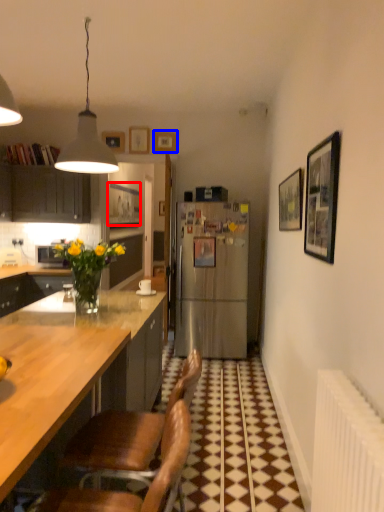
Question: Among these objects, which one is nearest to the camera, picture frame (highlighted by a red box) or picture frame (highlighted by a blue box)?

Choices:
 (A) picture frame
 (B) picture frame

Answer: (B)